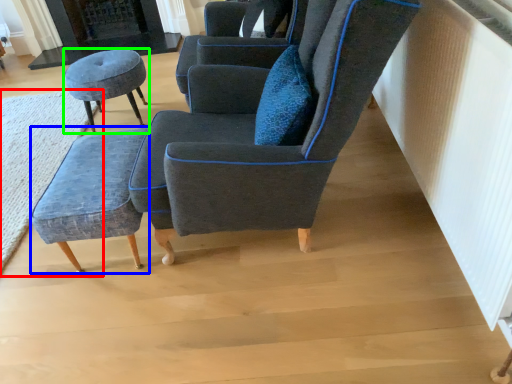
Question: Based on their relative distances, which object is nearer to mat (highlighted by a red box)? Choose from stool (highlighted by a blue box) and stool (highlighted by a green box).

Choices:
 (A) stool
 (B) stool

Answer: (B)